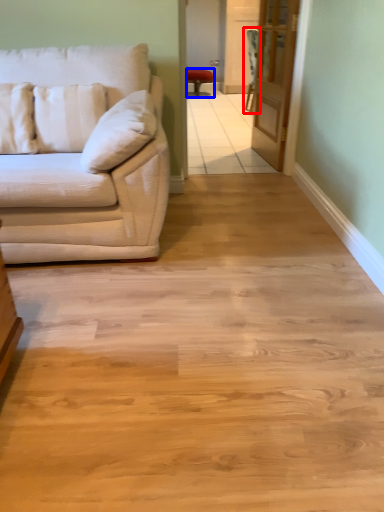
Question: Which point is closer to the camera, armchair (highlighted by a red box) or chair (highlighted by a blue box)?

Choices:
 (A) armchair
 (B) chair

Answer: (A)